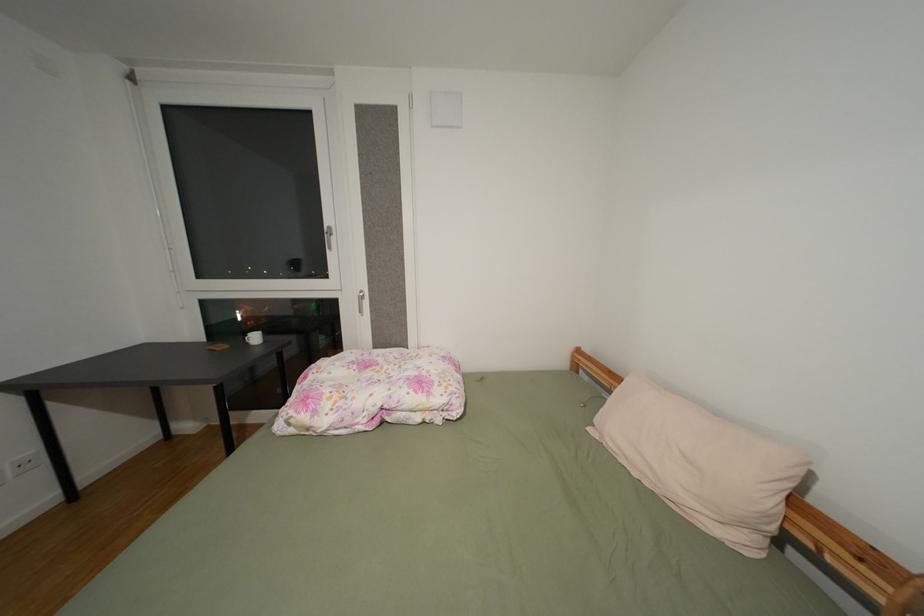
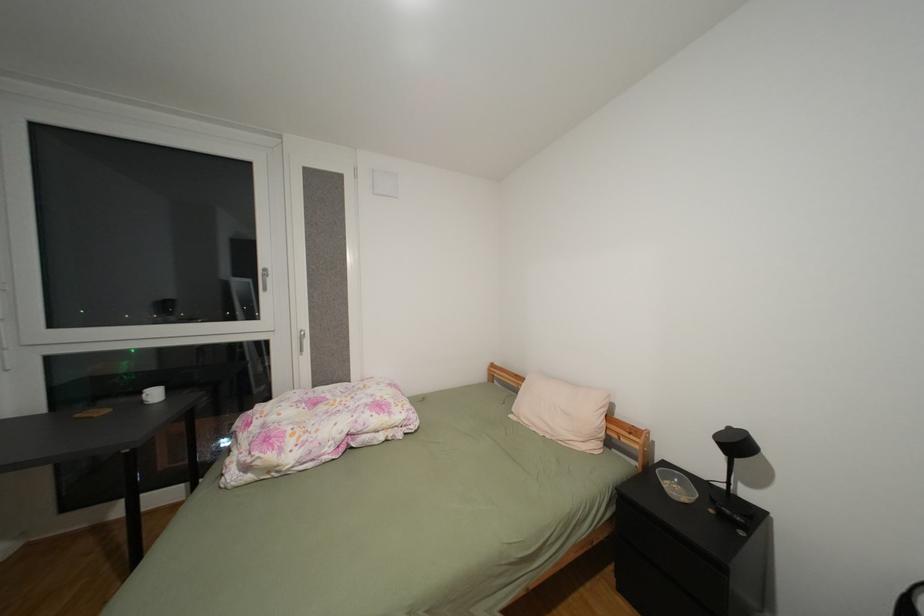
In a continuous first-person perspective shot, in which direction is the camera moving?

The movement direction of the cameraman is left, backward.